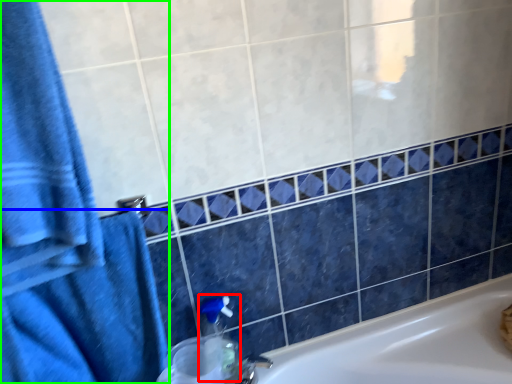
Question: Based on their relative distances, which object is nearer to soap dispenser (highlighted by a red box)? Choose from bath towel (highlighted by a blue box) and bath towel (highlighted by a green box).

Choices:
 (A) bath towel
 (B) bath towel

Answer: (A)